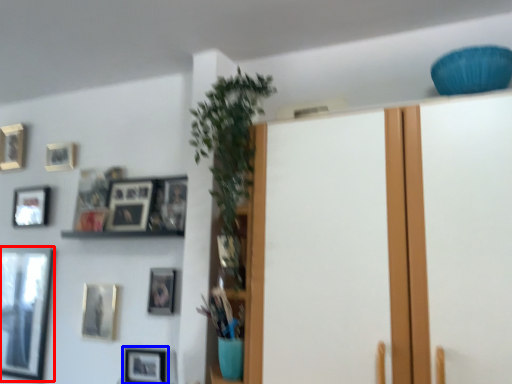
Question: Among these objects, which one is nearest to the camera, picture frame (highlighted by a red box) or picture frame (highlighted by a blue box)?

Choices:
 (A) picture frame
 (B) picture frame

Answer: (B)